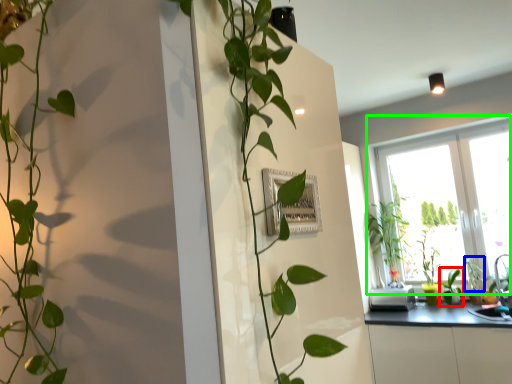
Question: Estimate the real-world distances between objects in this image. Which object is farther from plant (highlighted by a red box), plant (highlighted by a blue box) or window (highlighted by a green box)?

Choices:
 (A) plant
 (B) window

Answer: (B)